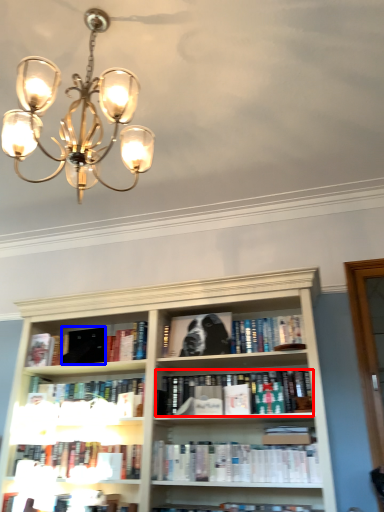
Question: Among these objects, which one is farthest to the camera, book (highlighted by a red box) or paperback book (highlighted by a blue box)?

Choices:
 (A) book
 (B) paperback book

Answer: (B)